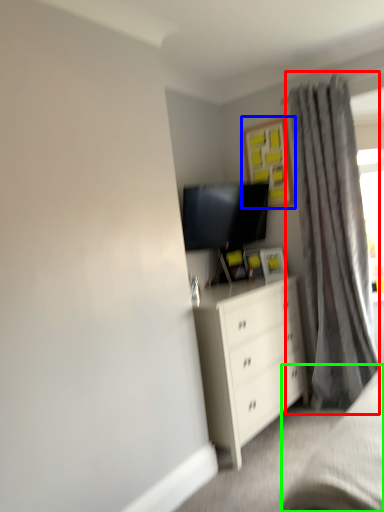
Question: Which object is the farthest from curtain (highlighted by a red box)? Choose among these: picture frame (highlighted by a blue box) or bed frame (highlighted by a green box).

Choices:
 (A) picture frame
 (B) bed frame

Answer: (B)